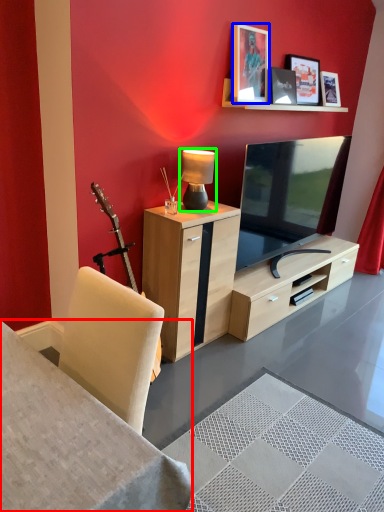
Question: Which object is positioned closest to desk (highlighted by a red box)? Select from picture frame (highlighted by a blue box) and table lamp (highlighted by a green box).

Choices:
 (A) picture frame
 (B) table lamp

Answer: (B)